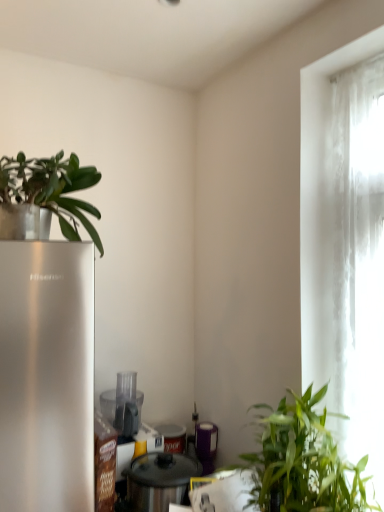
Question: Does metallic silver pot at center, the third appliance in the back-to-front sequence, have a lesser width compared to purple matte canister at center, which appears as the third appliance when viewed from the front?

Choices:
 (A) yes
 (B) no

Answer: (B)

Question: From a real-world perspective, does metallic silver pot at center, the third appliance in the back-to-front sequence, sit lower than purple matte canister at center, positioned as the first appliance in back-to-front order?

Choices:
 (A) no
 (B) yes

Answer: (B)

Question: Can you confirm if metallic silver pot at center, the third appliance in the back-to-front sequence, is shorter than purple matte canister at center, which appears as the third appliance when viewed from the front?

Choices:
 (A) no
 (B) yes

Answer: (B)

Question: Is metallic silver pot at center, the third appliance in the back-to-front sequence, not inside purple matte canister at center, which appears as the third appliance when viewed from the front?

Choices:
 (A) no
 (B) yes

Answer: (B)

Question: Is metallic silver pot at center, the third appliance in the back-to-front sequence, in front of purple matte canister at center, positioned as the first appliance in back-to-front order?

Choices:
 (A) yes
 (B) no

Answer: (A)

Question: Does metallic silver pot at center, the first appliance positioned from the front, appear on the right side of purple matte canister at center, which appears as the third appliance when viewed from the front?

Choices:
 (A) no
 (B) yes

Answer: (A)

Question: Is transparent plastic food processor at center, marked as the second appliance in a back-to-front arrangement, to the right of green leafy plant at lower right, arranged as the first houseplant when viewed from the right, from the viewer's perspective?

Choices:
 (A) no
 (B) yes

Answer: (A)

Question: Can you confirm if transparent plastic food processor at center, the 2th appliance positioned from the front, is thinner than green leafy plant at lower right, positioned as the second houseplant in top-to-bottom order?

Choices:
 (A) yes
 (B) no

Answer: (A)

Question: Would you say transparent plastic food processor at center, marked as the second appliance in a back-to-front arrangement, is outside green leafy plant at lower right, which is the first houseplant from bottom to top?

Choices:
 (A) no
 (B) yes

Answer: (B)

Question: Is transparent plastic food processor at center, marked as the second appliance in a back-to-front arrangement, to the left of green leafy plant at lower right, arranged as the first houseplant when viewed from the right, from the viewer's perspective?

Choices:
 (A) yes
 (B) no

Answer: (A)

Question: Can you confirm if transparent plastic food processor at center, marked as the second appliance in a back-to-front arrangement, is smaller than green leafy plant at lower right, positioned as the second houseplant in top-to-bottom order?

Choices:
 (A) no
 (B) yes

Answer: (B)

Question: Is transparent plastic food processor at center, the 2th appliance positioned from the front, far away from green leafy plant at lower right, acting as the second houseplant starting from the left?

Choices:
 (A) yes
 (B) no

Answer: (B)

Question: From the image's perspective, does metallic silver pot at center, the third appliance in the back-to-front sequence, appear lower than green matte plant at upper left, the 2th houseplant in the right-to-left sequence?

Choices:
 (A) yes
 (B) no

Answer: (A)